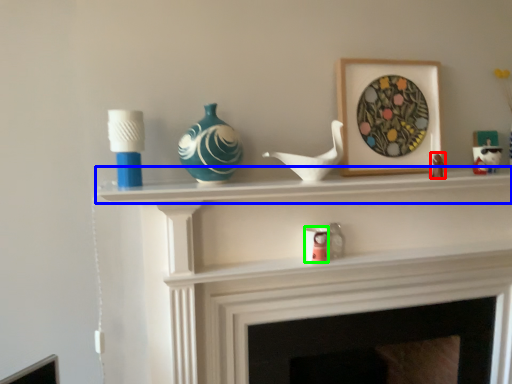
Question: Which object is positioned farthest from toy (highlighted by a red box)? Select from mantle (highlighted by a blue box) and candle holder (highlighted by a green box).

Choices:
 (A) mantle
 (B) candle holder

Answer: (B)